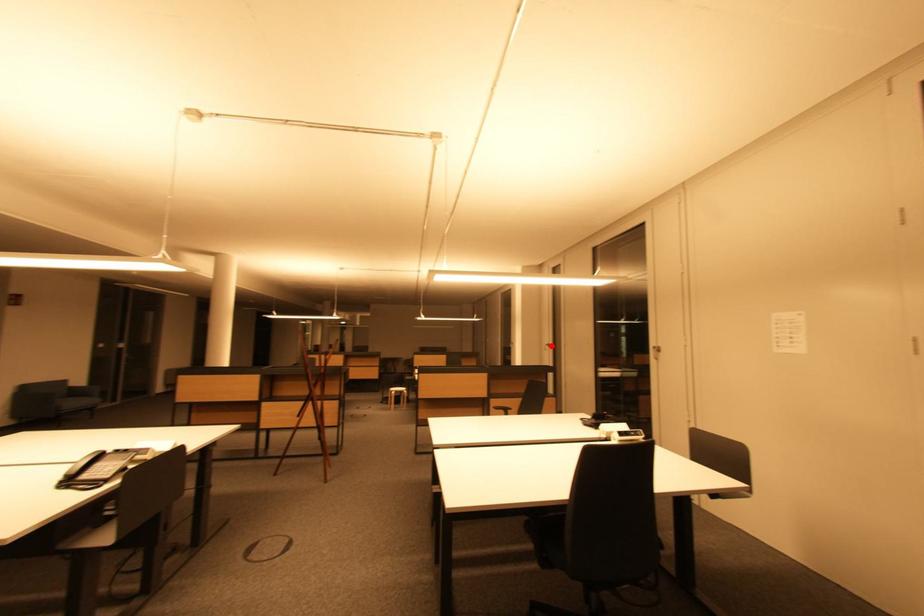
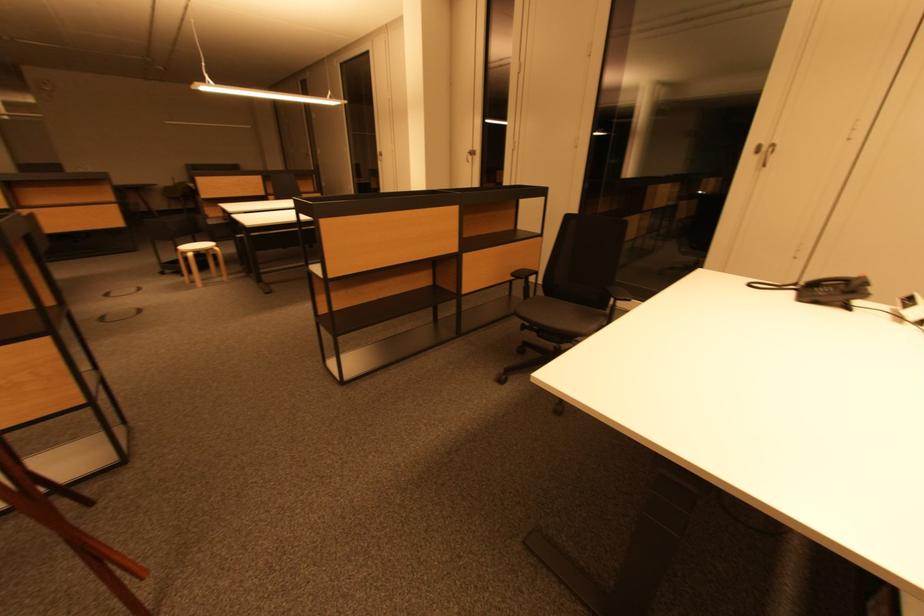
Question: I am providing you with two images of the same scene from different viewpoints. Given a red point in image1, look at the same physical point in image2. Is it:

Choices:
 (A) Closer to the viewpoint
 (B) Farther from the viewpoint

Answer: (A)